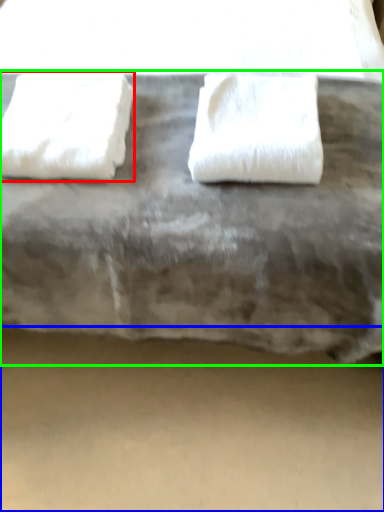
Question: Considering the real-world distances, which object is farthest from towel (highlighted by a red box)? concrete (highlighted by a blue box) or furniture (highlighted by a green box)?

Choices:
 (A) concrete
 (B) furniture

Answer: (A)